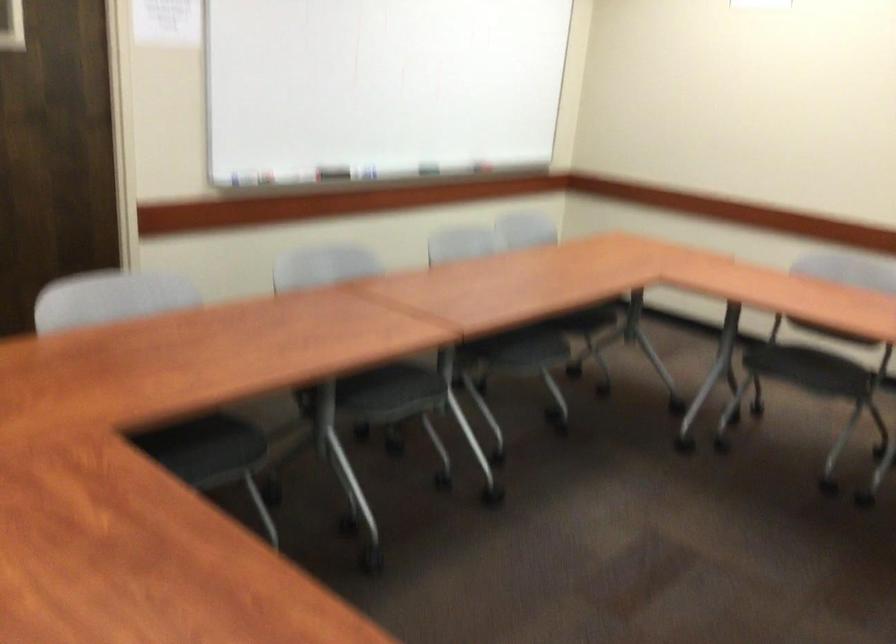
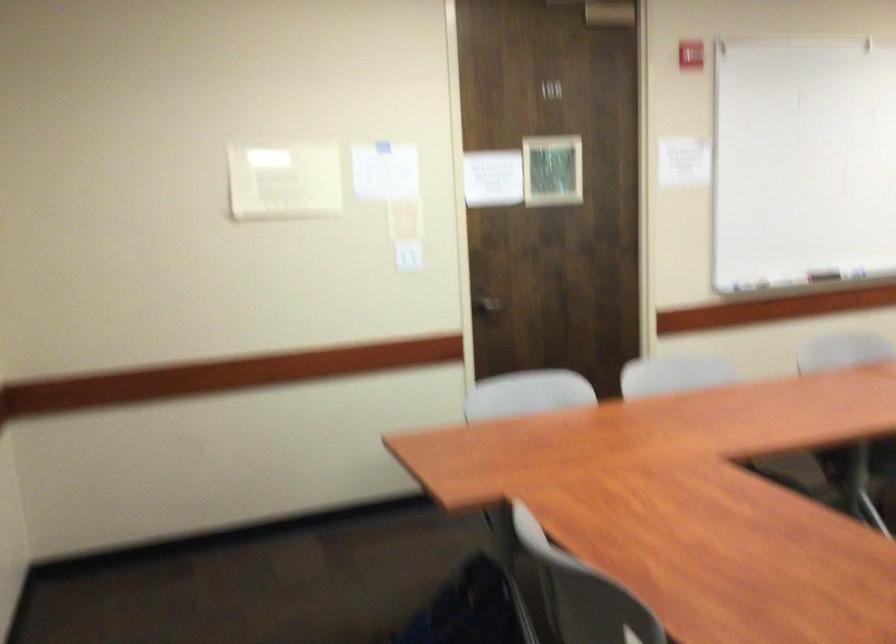
Question: How did the camera likely rotate?

Choices:
 (A) Left
 (B) Right
 (C) Up
 (D) Down

Answer: (A)